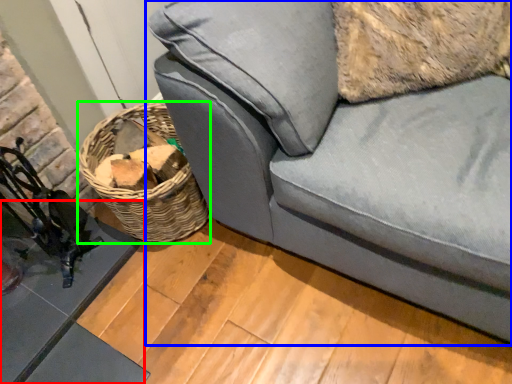
Question: Based on their relative distances, which object is farther from table (highlighted by a red box)? Choose from studio couch (highlighted by a blue box) and basket (highlighted by a green box).

Choices:
 (A) studio couch
 (B) basket

Answer: (A)